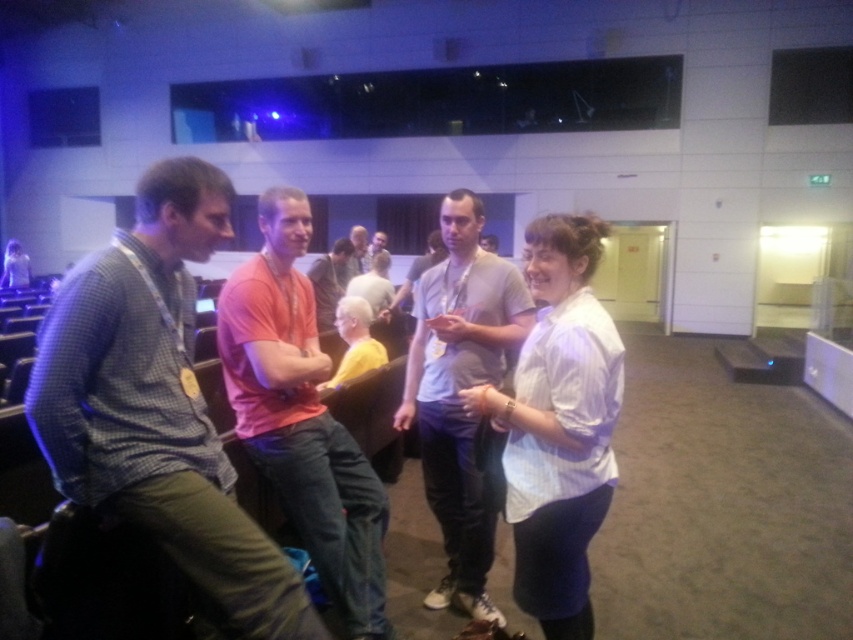
Question: Considering the relative positions of light gray cotton shirt at center and matte orange shirt at center in the image provided, where is light gray cotton shirt at center located with respect to matte orange shirt at center?

Choices:
 (A) above
 (B) below

Answer: (B)

Question: Is checkered fabric shirt at left to the left of light gray cotton shirt at center from the viewer's perspective?

Choices:
 (A) no
 (B) yes

Answer: (B)

Question: Which object appears closest to the camera in this image?

Choices:
 (A) matte gray shirt at center
 (B) matte orange shirt at center
 (C) matte orange t-shirt at center
 (D) checkered fabric shirt at left

Answer: (D)

Question: Estimate the real-world distances between objects in this image. Which object is closer to the light gray cotton shirt at center?

Choices:
 (A) matte gray shirt at center
 (B) matte orange t-shirt at center
 (C) matte orange shirt at center
 (D) checkered fabric shirt at left

Answer: (B)

Question: Which object appears closest to the camera in this image?

Choices:
 (A) matte orange shirt at center
 (B) checkered fabric shirt at left
 (C) matte orange t-shirt at center

Answer: (B)

Question: Is matte orange t-shirt at center bigger than matte gray shirt at center?

Choices:
 (A) yes
 (B) no

Answer: (B)